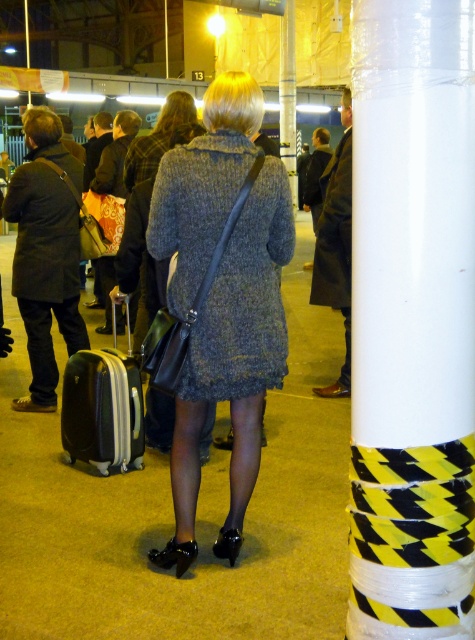
You are standing in the train station and need to locate the white plastic column at right and the white plastic pole at upper center. Which one is smaller in size?

The white plastic column at right is smaller in size compared to the white plastic pole at upper center.

You are navigating through the indoor transit hub and need to reach a specific location. You have two points marked on your map labeled as point (x=216, y=218) and point (x=67, y=394). Which of these points is physically closer to your current position?

Point (x=216, y=218) is closer to the viewer than point (x=67, y=394), so the point labeled (x=216, y=218) is closer to your current position.

In the scene described, there is a knitted wool dress at center and a black hardshell suitcase at lower left. From the perspective of an observer facing the scene, which object is positioned to the right of the other?

The knitted wool dress at center is to the right of the black hardshell suitcase at lower left.